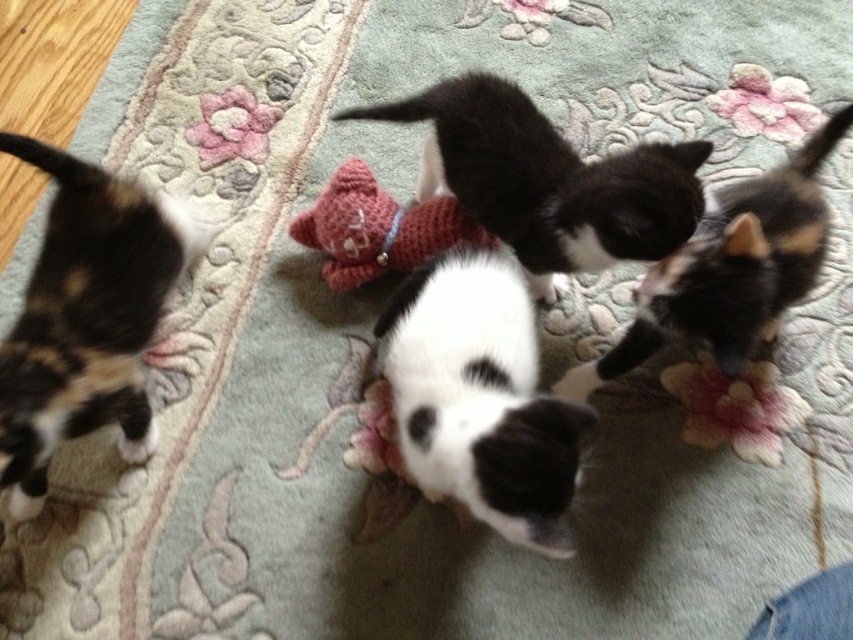
Who is higher up, black and white fur at center or black fur cat at upper right?

black fur cat at upper right is higher up.

Which of these two, black and white fur at center or black fur cat at upper right, stands taller?

Standing taller between the two is black fur cat at upper right.

Who is more forward, (492, 314) or (788, 264)?

Point (492, 314) is more forward.

Find the location of a particular element. This screenshot has height=640, width=853. black and white fur at center is located at coordinates (480, 397).

Which is more to the right, calico fur cat at left or black and white fur at center?

black and white fur at center is more to the right.

Between point (144, 429) and point (517, 291), which one is positioned behind?

The point (144, 429) is more distant.

This screenshot has width=853, height=640. Find the location of `calico fur cat at left`. calico fur cat at left is located at coordinates (86, 317).

Who is lower down, calico fur cat at left or black matte fur cat at center?

calico fur cat at left is lower down.

Measure the distance between point (164, 256) and camera.

A distance of 3.92 feet exists between point (164, 256) and camera.

Is point (138, 257) farther from camera compared to point (450, 97)?

No, (138, 257) is closer to viewer.

You are a GUI agent. You are given a task and a screenshot of the screen. Output one action in this format:
    pyautogui.click(x=<x>, y=<y>)
    Task: Click on the calico fur cat at left
    
    Given the screenshot: What is the action you would take?
    pyautogui.click(x=86, y=317)